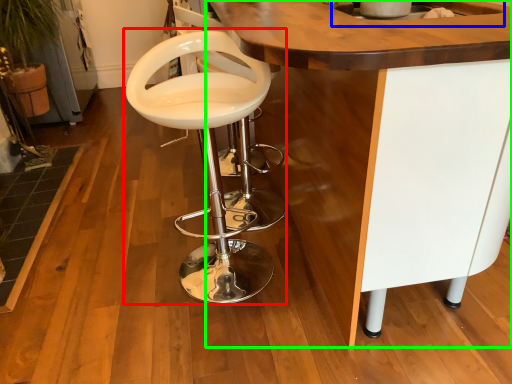
Question: Based on their relative distances, which object is nearer to chair (highlighted by a red box)? Choose from sink (highlighted by a blue box) and table (highlighted by a green box).

Choices:
 (A) sink
 (B) table

Answer: (B)